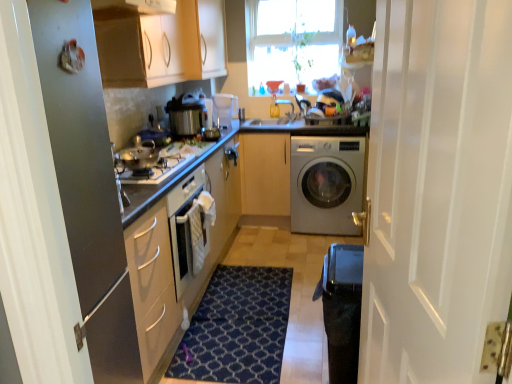
Where is `empty space that is to the right of translucent glass coffee cup at upper center`? The width and height of the screenshot is (512, 384). empty space that is to the right of translucent glass coffee cup at upper center is located at coordinates (289, 117).